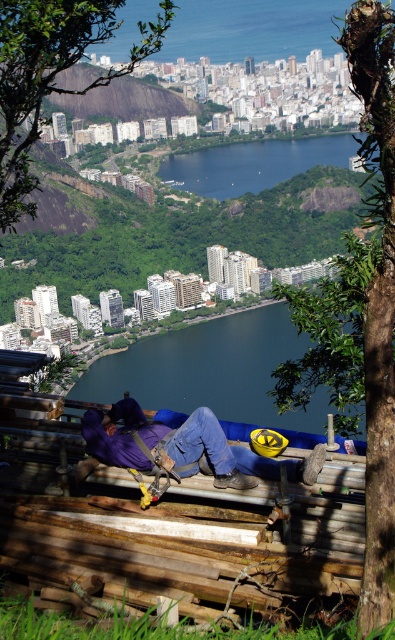
Question: Estimate the real-world distances between objects in this image. Which object is closer to the dark blue water at center?

Choices:
 (A) purple fabric at center
 (B) blue glassy water at center

Answer: (A)

Question: Can you confirm if dark blue water at center is thinner than blue glassy water at center?

Choices:
 (A) no
 (B) yes

Answer: (A)

Question: Can you confirm if dark blue water at center is thinner than purple fabric at center?

Choices:
 (A) yes
 (B) no

Answer: (B)

Question: Which of the following is the closest to the observer?

Choices:
 (A) purple fabric at center
 (B) dark blue water at center
 (C) blue glassy water at center

Answer: (A)

Question: Considering the relative positions of purple fabric at center and blue glassy water at center in the image provided, where is purple fabric at center located with respect to blue glassy water at center?

Choices:
 (A) above
 (B) below

Answer: (B)

Question: Estimate the real-world distances between objects in this image. Which object is closer to the dark blue water at center?

Choices:
 (A) purple fabric at center
 (B) blue glassy water at center

Answer: (A)